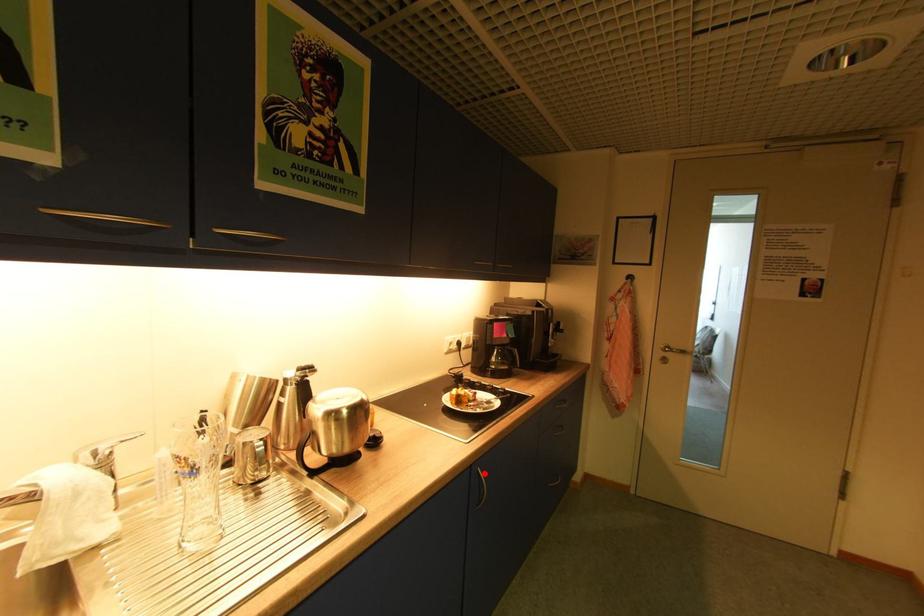
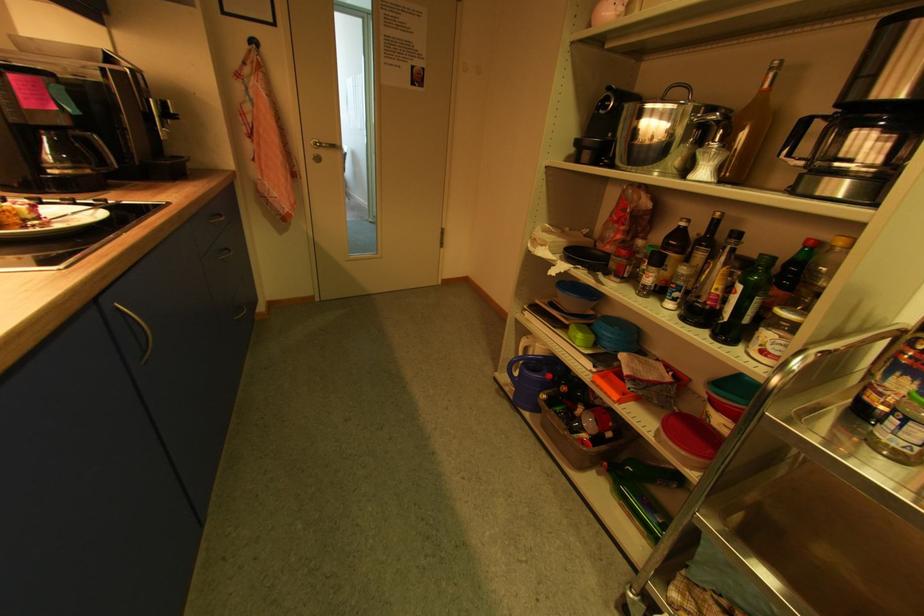
Locate, in the second image, the point that corresponds to the highlighted location in the first image.

(125, 310)